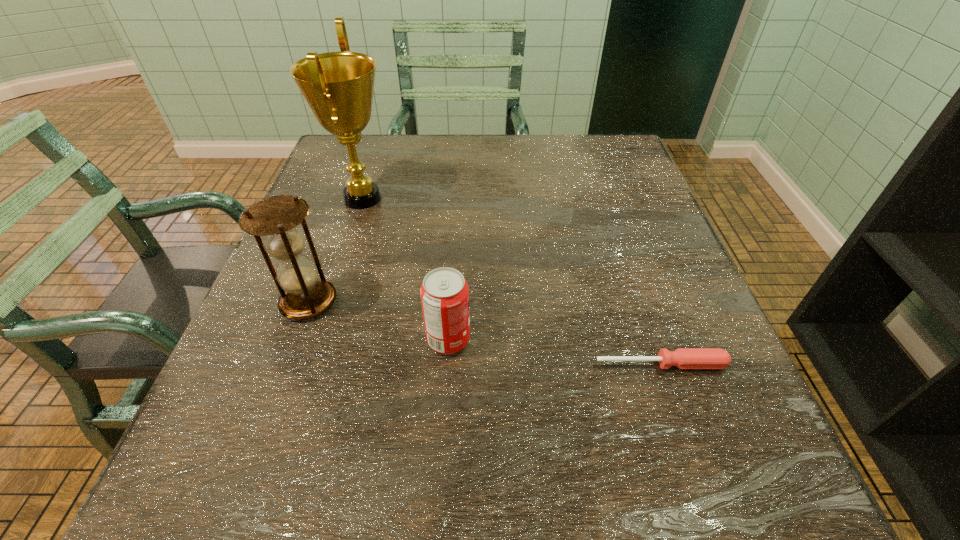
The width and height of the screenshot is (960, 540). What are the coordinates of `the tallest object` in the screenshot? It's located at (338, 86).

The image size is (960, 540). I want to click on the farthest object, so click(338, 86).

Image resolution: width=960 pixels, height=540 pixels. In order to click on hourglass in this screenshot , I will do `click(303, 296)`.

Where is `the third tallest object`? The width and height of the screenshot is (960, 540). the third tallest object is located at coordinates (444, 293).

This screenshot has width=960, height=540. I want to click on the second object from right to left, so click(x=444, y=293).

Locate an element on the screen. The image size is (960, 540). the rightmost object is located at coordinates (683, 358).

Find the location of a particular element. The image size is (960, 540). the shortest object is located at coordinates (683, 358).

Find the location of a particular element. The width and height of the screenshot is (960, 540). vacant space located 0.240m on the front view with handles of the award is located at coordinates (498, 198).

You are a GUI agent. You are given a task and a screenshot of the screen. Output one action in this format:
    pyautogui.click(x=<x>, y=<y>)
    Task: Click on the vacant area situated on the back of the third shortest object
    The height and width of the screenshot is (540, 960).
    Given the screenshot: What is the action you would take?
    pyautogui.click(x=356, y=172)

You are a GUI agent. You are given a task and a screenshot of the screen. Output one action in this format:
    pyautogui.click(x=<x>, y=<y>)
    Task: Click on the blank area located 0.100m on the left of the third tallest object
    
    Given the screenshot: What is the action you would take?
    pyautogui.click(x=368, y=340)